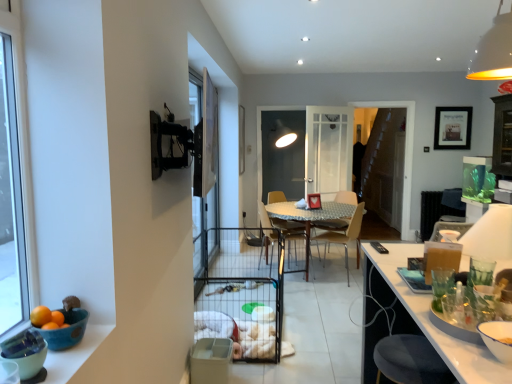
Question: From the image's perspective, is yellow matte lampshade at upper right located above wooden chair at center, which is counted as the 2th chair, starting from the right?

Choices:
 (A) no
 (B) yes

Answer: (B)

Question: Considering the relative sizes of yellow matte lampshade at upper right and wooden chair at center, which is counted as the 2th chair, starting from the right, in the image provided, is yellow matte lampshade at upper right bigger than wooden chair at center, which is counted as the 2th chair, starting from the right,?

Choices:
 (A) yes
 (B) no

Answer: (B)

Question: From the image's perspective, is yellow matte lampshade at upper right located beneath wooden chair at center, which is counted as the 2th chair, starting from the right?

Choices:
 (A) yes
 (B) no

Answer: (B)

Question: Does yellow matte lampshade at upper right appear on the left side of wooden chair at center, which is the second chair from front to back?

Choices:
 (A) yes
 (B) no

Answer: (B)

Question: Can you confirm if yellow matte lampshade at upper right is positioned to the right of wooden chair at center, which is the first chair from left to right?

Choices:
 (A) yes
 (B) no

Answer: (A)

Question: Is yellow matte lampshade at upper right not near wooden chair at center, which is counted as the first chair, starting from the back?

Choices:
 (A) yes
 (B) no

Answer: (A)

Question: Can you confirm if clear glass screen door at center, positioned as the 2th screen door in right-to-left order, is taller than wooden chair at center?

Choices:
 (A) no
 (B) yes

Answer: (B)

Question: Is clear glass screen door at center, positioned as the first screen door in front-to-back order, facing away from wooden chair at center?

Choices:
 (A) no
 (B) yes

Answer: (A)

Question: Does clear glass screen door at center, which is counted as the 1th screen door, starting from the left, appear on the right side of wooden chair at center?

Choices:
 (A) no
 (B) yes

Answer: (A)

Question: Is the depth of clear glass screen door at center, positioned as the first screen door in front-to-back order, less than that of wooden chair at center?

Choices:
 (A) no
 (B) yes

Answer: (B)

Question: Does clear glass screen door at center, positioned as the first screen door in front-to-back order, have a larger size compared to wooden chair at center?

Choices:
 (A) no
 (B) yes

Answer: (A)

Question: Does clear glass screen door at center, positioned as the first screen door in front-to-back order, have a greater width compared to wooden chair at center?

Choices:
 (A) yes
 (B) no

Answer: (B)

Question: From the image's perspective, is blue ceramic bowl at lower left, the first bowl positioned from the back, beneath transparent glass screen door at center, the second screen door when ordered from front to back?

Choices:
 (A) yes
 (B) no

Answer: (A)